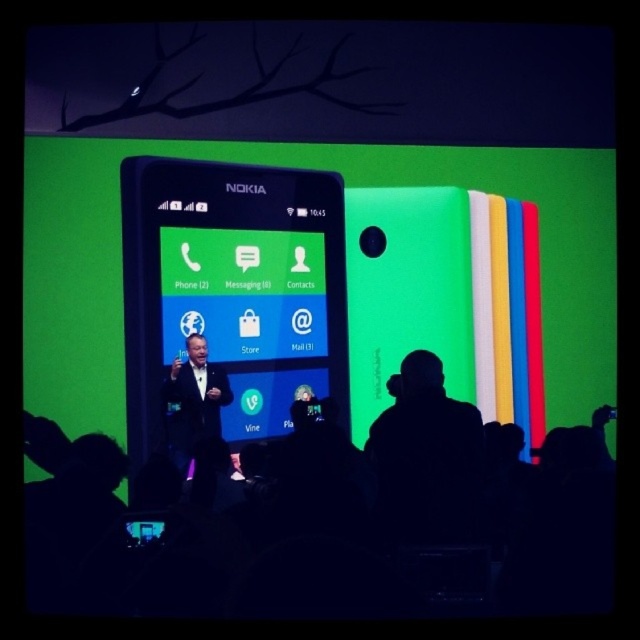
You are an attendee at the presentation and want to see both the black glossy phone at center and the shiny black suit at center clearly. Which one appears larger in your view?

The black glossy phone at center appears larger because it is closer to the viewer than the shiny black suit at center.

You are an event organizer who needs to ensure that all items on stage are visible to the audience. Given that the black glossy phone at center and the shiny black suit at center are both at the center, which item is more likely to catch the audience attention due to its size?

The black glossy phone at center is larger in size than the shiny black suit at center, so it is more likely to catch the audience attention due to its size.

You are standing in the presentation room and want to take a photo of the Nokia smartphone displayed on the screen. The camera you have is at point (280, 214). Is the camera positioned close enough to capture the entire smartphone on the screen clearly?

The point (280, 214) and camera are 8.48 feet apart from each other. Since the distance is relatively close, the camera should be able to capture the entire smartphone on the screen clearly.